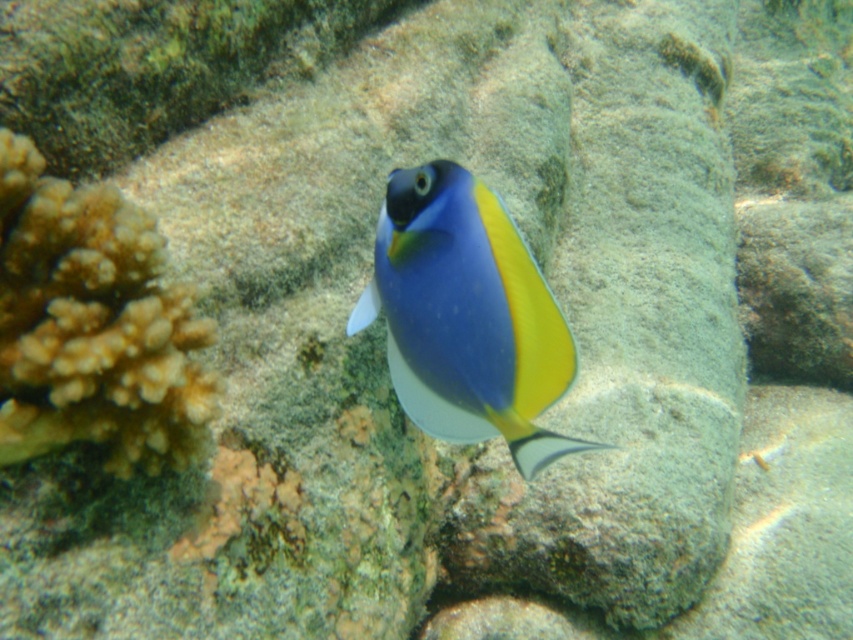
Find the location of a particular element. The width and height of the screenshot is (853, 640). brown textured coral at left is located at coordinates (91, 324).

Between brown textured coral at left and matte blue fish at center, which one is positioned lower?

A: matte blue fish at center is below.

Does point (189, 454) come closer to viewer compared to point (543, 436)?

No, (189, 454) is further to viewer.

Locate an element on the screen. The width and height of the screenshot is (853, 640). brown textured coral at left is located at coordinates (91, 324).